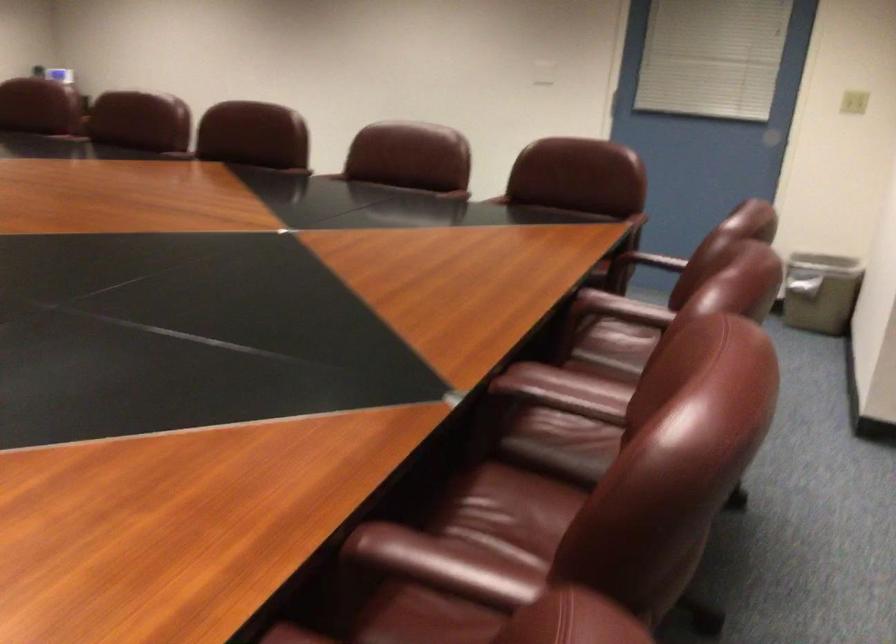
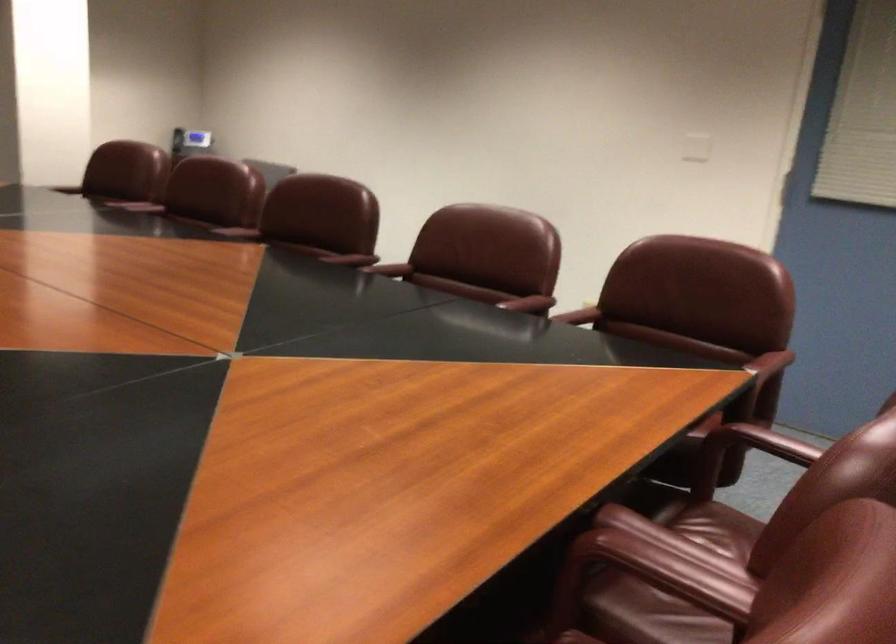
Find the pixel in the second image that matches point (625, 315) in the first image.

(657, 573)